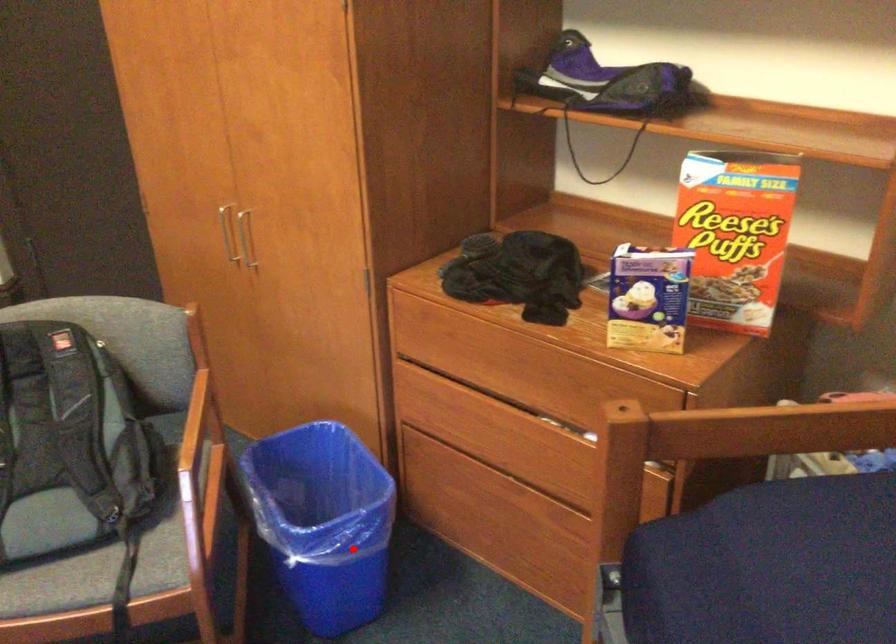
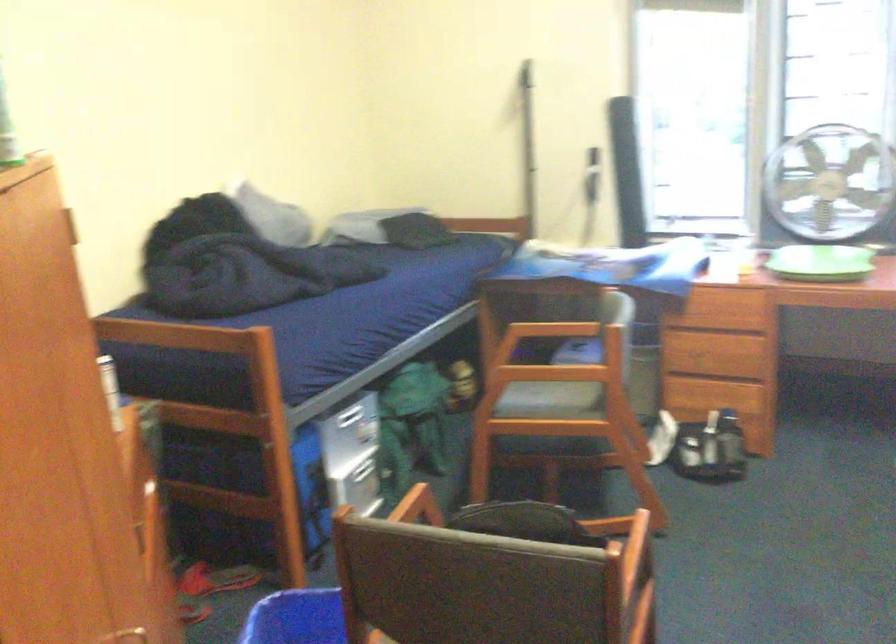
Where in the second image is the point corresponding to the highlighted location from the first image?

(297, 618)